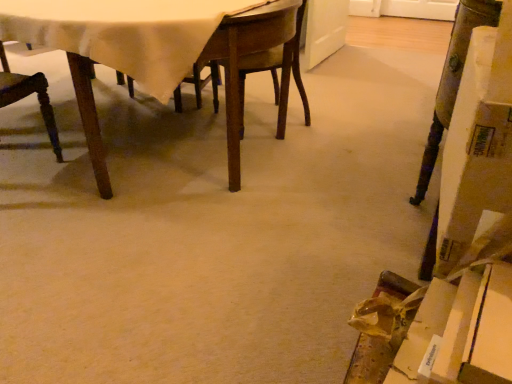
At what (x,y) coordinates should I click in order to perform the action: click on wooden table at center. Please return your answer as a coordinate pair (x, y). The width and height of the screenshot is (512, 384). Looking at the image, I should click on (168, 50).

Image resolution: width=512 pixels, height=384 pixels. Describe the element at coordinates (168, 50) in the screenshot. I see `wooden table at center` at that location.

Locate an element on the screen. The image size is (512, 384). wooden chair at left is located at coordinates (28, 95).

What do you see at coordinates (28, 95) in the screenshot? I see `wooden chair at left` at bounding box center [28, 95].

Find the location of a particular element. The width and height of the screenshot is (512, 384). wooden table at center is located at coordinates (168, 50).

Which object is positioned more to the left, wooden table at center or wooden chair at left?

wooden chair at left.

Which object is further away from the camera taking this photo, wooden table at center or wooden chair at left?

wooden chair at left is behind.

Is point (118, 67) positioned after point (48, 112)?

No, it is in front of (48, 112).

From the image's perspective, does wooden table at center appear lower than wooden chair at left?

Incorrect, from the image's perspective, wooden table at center is higher than wooden chair at left.

From a real-world perspective, relative to wooden chair at left, is wooden table at center vertically above or below?

From a real-world perspective, wooden table at center is physically above wooden chair at left.

Considering the sizes of objects wooden table at center and wooden chair at left in the image provided, who is wider, wooden table at center or wooden chair at left?

wooden table at center is wider.

Can you confirm if wooden table at center is taller than wooden chair at left?

No, wooden table at center is not taller than wooden chair at left.

Between wooden table at center and wooden chair at left, which one has smaller size?

Smaller between the two is wooden chair at left.

In the scene shown: Would you say wooden table at center contains wooden chair at left?

Yes.

Is wooden table at center not close to wooden chair at left?

They are positioned close to each other.

Could you tell me if wooden table at center is turned towards wooden chair at left?

Yes, wooden table at center is oriented towards wooden chair at left.

The height and width of the screenshot is (384, 512). Identify the location of table above the wooden chair at left (from the image's perspective). (168, 50).

Can you confirm if wooden chair at left is positioned to the right of wooden table at center?

Incorrect, wooden chair at left is not on the right side of wooden table at center.

Is wooden chair at left closer to camera compared to wooden table at center?

That is False.

Considering the positions of point (46, 83) and point (98, 185), is point (46, 83) closer or farther from the camera than point (98, 185)?

Point (46, 83) appears to be farther away from the viewer than point (98, 185).

From the image's perspective, is wooden chair at left on wooden table at center?

No, from the image's perspective, wooden chair at left is not over wooden table at center.

From a real-world perspective, is wooden chair at left over wooden table at center?

Actually, wooden chair at left is physically below wooden table at center in the real world.

Considering the sizes of objects wooden chair at left and wooden table at center in the image provided, who is thinner, wooden chair at left or wooden table at center?

wooden chair at left is thinner.

Is wooden chair at left shorter than wooden table at center?

Incorrect, the height of wooden chair at left does not fall short of that of wooden table at center.

Who is smaller, wooden chair at left or wooden table at center?

wooden chair at left is smaller.

Is wooden chair at left spatially inside wooden table at center, or outside of it?

wooden chair at left is located inside wooden table at center.

Is wooden chair at left positioned far away from wooden table at center?

They are positioned close to each other.

Is wooden chair at left oriented towards wooden table at center?

Yes, wooden chair at left is oriented towards wooden table at center.

How many degrees apart are the facing directions of wooden chair at left and wooden table at center?

173 degrees separate the facing orientations of wooden chair at left and wooden table at center.

This screenshot has height=384, width=512. I want to click on table in front of the wooden chair at left, so click(x=168, y=50).

Locate an element on the screen. This screenshot has height=384, width=512. table located on the right of wooden chair at left is located at coordinates (168, 50).

You are a GUI agent. You are given a task and a screenshot of the screen. Output one action in this format:
    pyautogui.click(x=<x>, y=<y>)
    Task: Click on the chair lying behind the wooden table at center
    Image resolution: width=512 pixels, height=384 pixels.
    Given the screenshot: What is the action you would take?
    pyautogui.click(x=28, y=95)